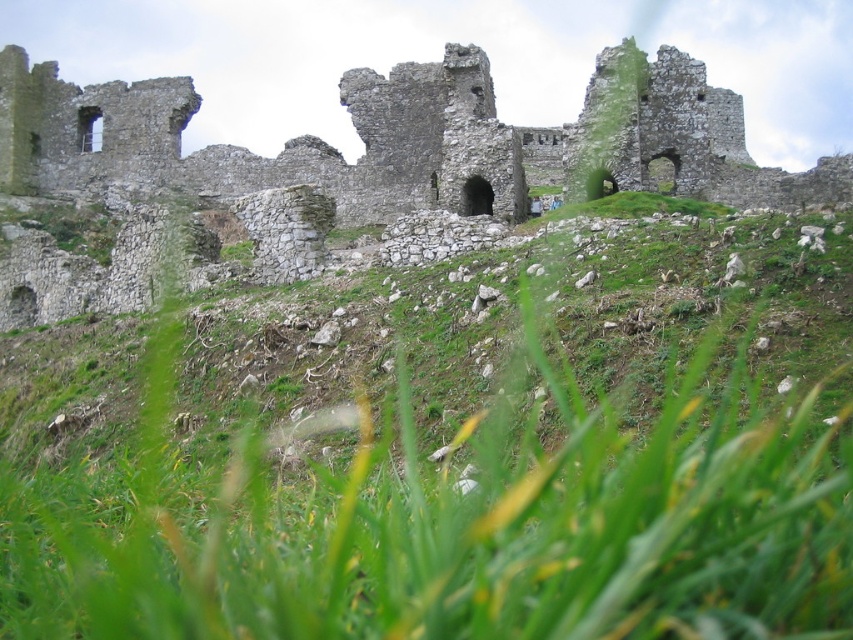
You are standing at the point marked by the coordinates point (445, 454) in the image. What is the immediate surface you are standing on?

The point (445, 454) corresponds to the green grassy area at center, so you are standing on the green grassy at center.

You are a photographer standing at the base of the hill where the ruins are located. You want to capture a photo that includes both the point at coordinates point (722, 310) and point (515, 173). Given that your camera has a fixed focal length and you can only adjust your position, which direction should you move to ensure both points are in focus?

To ensure both points are in focus, you should move closer to the camera because point (722, 310) is closer to the camera than point (515, 173). By moving closer, you can adjust the depth of field to include both points within the focused area.

In the scene shown: You are a photographer planning to capture a landscape shot of the green grassy at center and the stone ruins at upper center. Given the scene described, which of the two elements has a narrower width in the image?

The green grassy at center has a narrower width compared to the stone ruins at upper center.